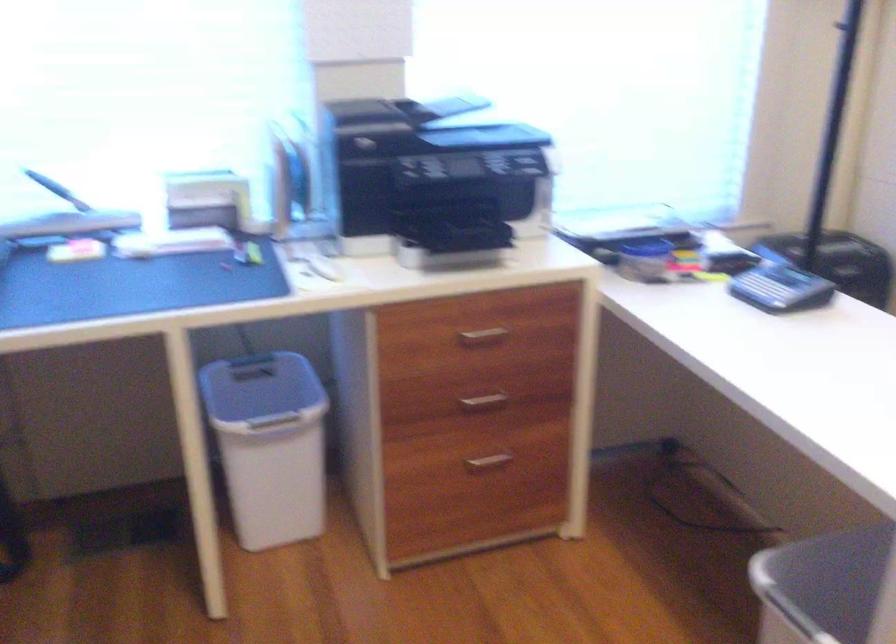
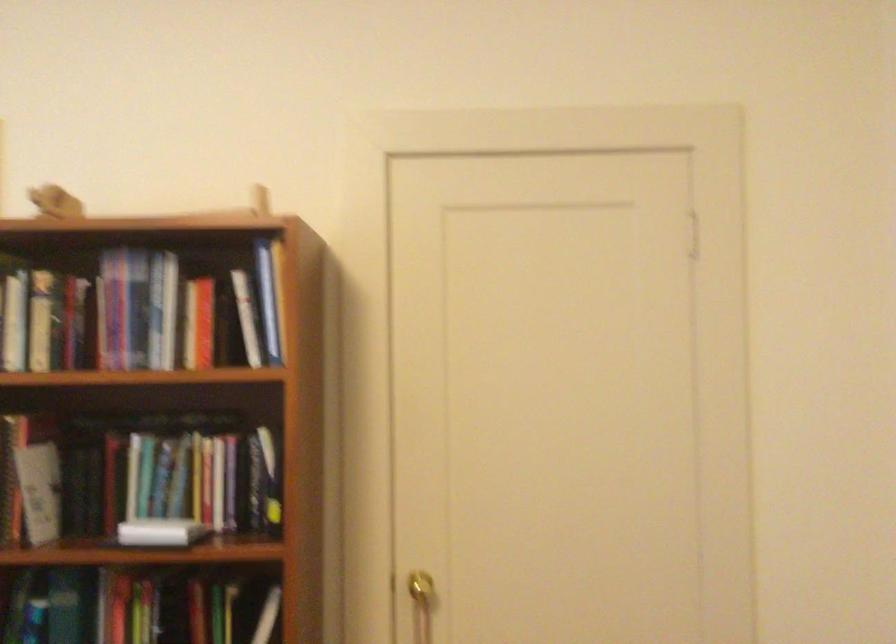
Question: The camera is either moving clockwise (left) or counter-clockwise (right) around the object. The first image is from the beginning of the video and the second image is from the end. Is the camera moving left or right when shooting the video?

Choices:
 (A) Left
 (B) Right

Answer: (A)